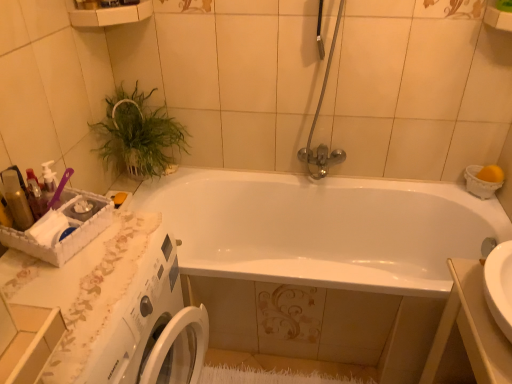
The width and height of the screenshot is (512, 384). In order to click on unoccupied region to the right of shiny plastic bottles at left in this screenshot , I will do `click(101, 251)`.